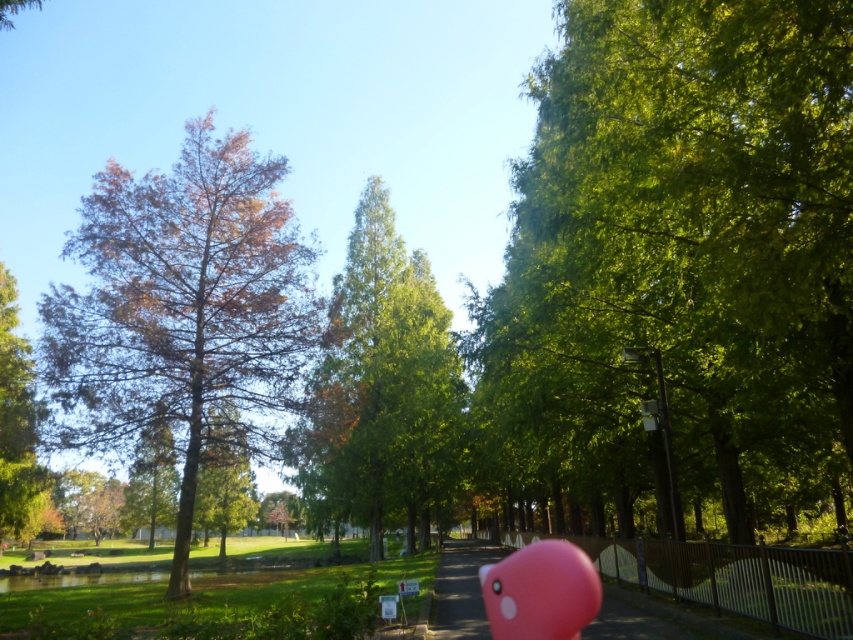
Can you confirm if green glossy tree at center is bigger than green matte tree at center?

Indeed, green glossy tree at center has a larger size compared to green matte tree at center.

Can you confirm if green glossy tree at center is thinner than green matte tree at center?

No.

You are a GUI agent. You are given a task and a screenshot of the screen. Output one action in this format:
    pyautogui.click(x=<x>, y=<y>)
    Task: Click on the green glossy tree at center
    
    Given the screenshot: What is the action you would take?
    pyautogui.click(x=380, y=390)

Is the position of pink rubber duck at center less distant than that of pink rubber balloon at lower right?

Yes, it is in front of pink rubber balloon at lower right.

Looking at this image, is pink rubber duck at center to the left of pink rubber balloon at lower right from the viewer's perspective?

Indeed, pink rubber duck at center is positioned on the left side of pink rubber balloon at lower right.

Find the location of a particular element. pink rubber duck at center is located at coordinates click(654, 618).

Identify the location of pink rubber duck at center. (654, 618).

Is point (787, 269) positioned after point (407, 496)?

No, (787, 269) is closer to viewer.

What do you see at coordinates (677, 268) in the screenshot? I see `green leafy tree at right` at bounding box center [677, 268].

Does point (746, 204) come in front of point (410, 282)?

Yes.

Find the location of a particular element. green leafy tree at right is located at coordinates (677, 268).